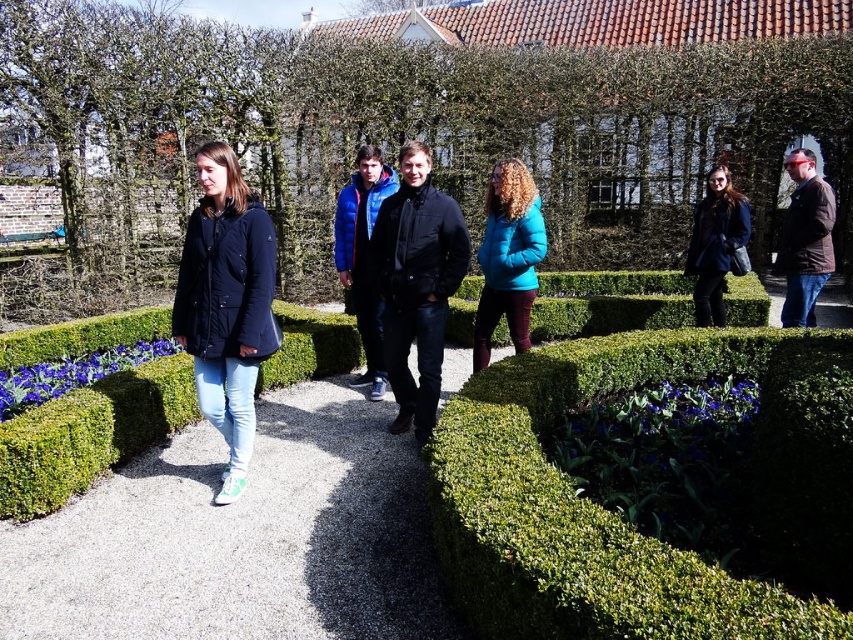
Question: Among these objects, which one is farthest from the camera?

Choices:
 (A) green hedge at center
 (B) teal matte jacket at center
 (C) green leafy hedge at center
 (D) matte black jacket at center

Answer: (B)

Question: Which object is closer to the camera taking this photo?

Choices:
 (A) black matte jacket at center
 (B) matte black jacket at center

Answer: (B)

Question: Is green leafy hedge at center bigger than blue down jacket at center?

Choices:
 (A) yes
 (B) no

Answer: (A)

Question: Which of the following is the farthest from the observer?

Choices:
 (A) (483, 275)
 (B) (375, 212)

Answer: (A)

Question: Can you confirm if teal matte jacket at center is positioned below matte black coat at center?

Choices:
 (A) no
 (B) yes

Answer: (B)

Question: Does black matte jacket at center appear on the left side of teal matte jacket at center?

Choices:
 (A) no
 (B) yes

Answer: (B)